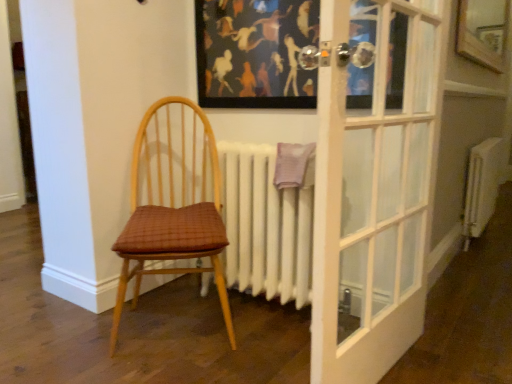
The height and width of the screenshot is (384, 512). I want to click on free space between wooden chair with woven seat cushion at left and white matte radiator at center, marked as the first radiator in a left-to-right arrangement, so click(x=262, y=336).